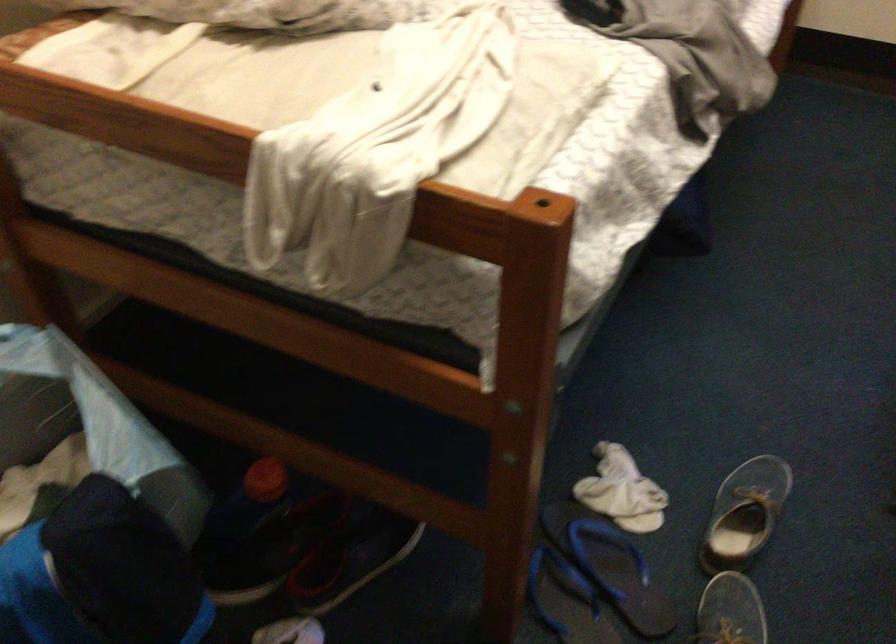
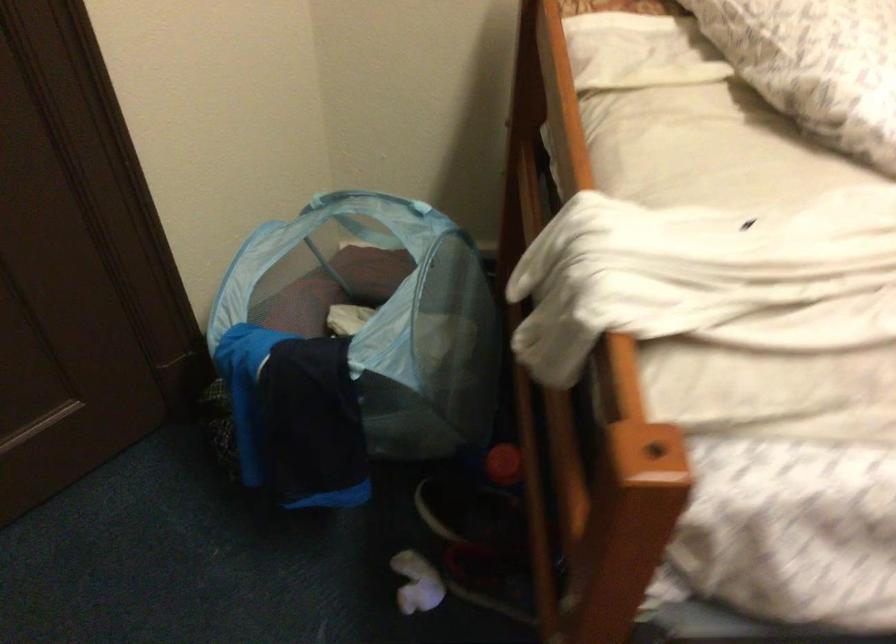
The point at (102, 471) is marked in the first image. Where is the corresponding point in the second image?

(354, 345)